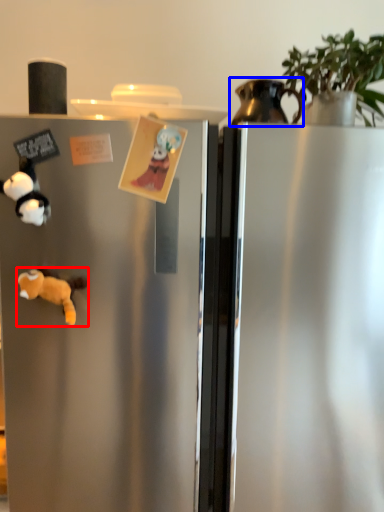
Question: Which of the following is the closest to the observer, animal (highlighted by a red box) or appliance (highlighted by a blue box)?

Choices:
 (A) animal
 (B) appliance

Answer: (A)